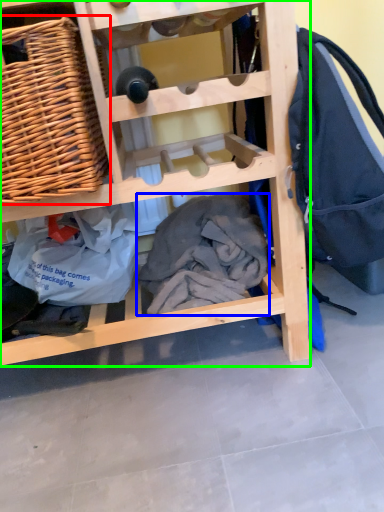
Question: Based on their relative distances, which object is farther from picnic basket (highlighted by a red box)? Choose from clothing (highlighted by a blue box) and furniture (highlighted by a green box).

Choices:
 (A) clothing
 (B) furniture

Answer: (A)